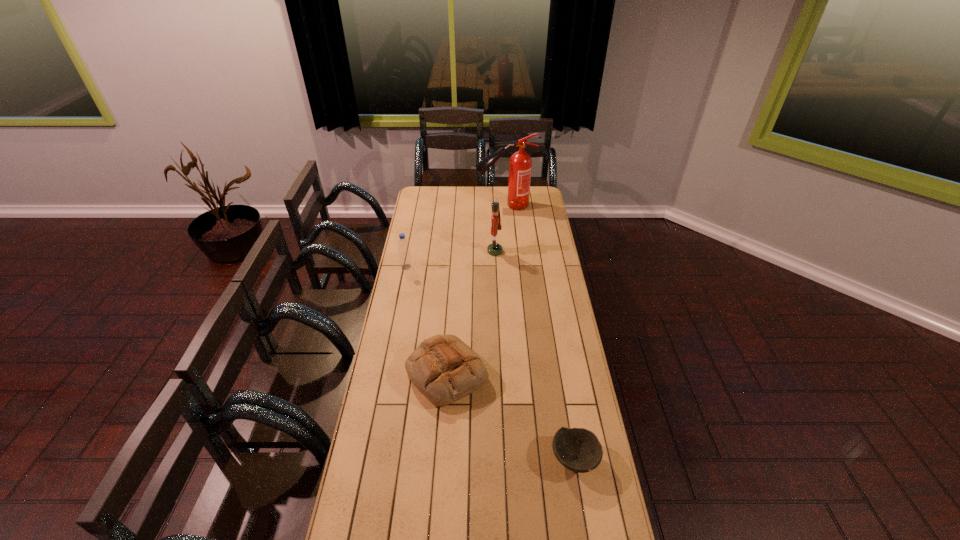
Find the location of a particular element. This screenshot has width=960, height=540. free space located 0.300m at the nozzle end of the farthest object is located at coordinates (427, 205).

Where is `free space located at the nozzle end of the farthest object`? Image resolution: width=960 pixels, height=540 pixels. free space located at the nozzle end of the farthest object is located at coordinates (466, 205).

At what (x,y) coordinates should I click in order to perform the action: click on free space located at the nozzle end of the farthest object. Please return your answer as a coordinate pair (x, y). The image size is (960, 540). Looking at the image, I should click on (453, 205).

Image resolution: width=960 pixels, height=540 pixels. Find the location of `free space located on the front-facing side of the second tallest object`. free space located on the front-facing side of the second tallest object is located at coordinates (466, 251).

Image resolution: width=960 pixels, height=540 pixels. I want to click on blank area located 0.120m on the front-facing side of the second tallest object, so click(466, 251).

Where is `vacant space located 0.150m on the front-facing side of the second tallest object`? vacant space located 0.150m on the front-facing side of the second tallest object is located at coordinates (460, 251).

Identify the location of vacant space located on the right of the third farthest object. The image size is (960, 540). (444, 267).

What are the coordinates of `vacant space situated on the left of the second nearest object` in the screenshot? It's located at (390, 374).

The height and width of the screenshot is (540, 960). I want to click on free spot located 0.370m on the left of the bowl, so coord(445,458).

Where is `object that is at the far edge`? object that is at the far edge is located at coordinates (520, 163).